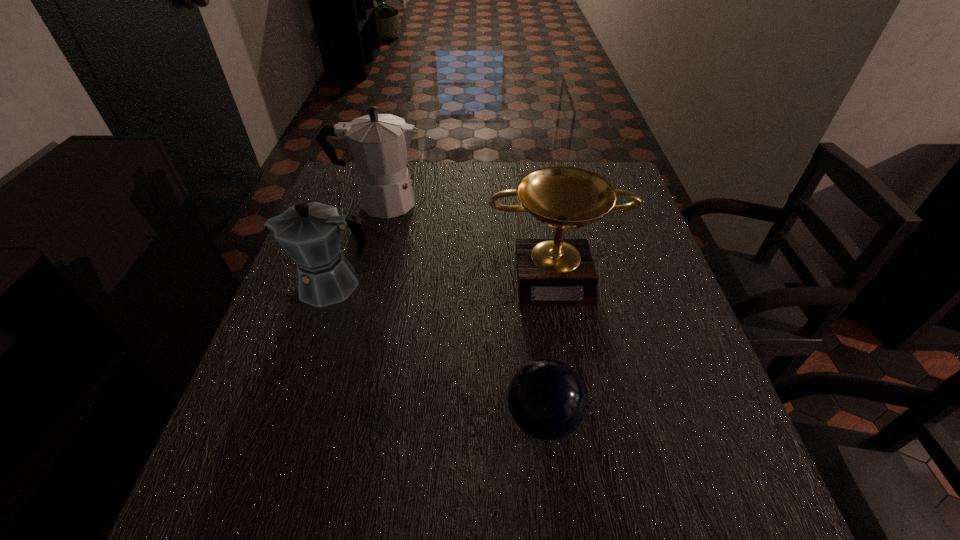
Image resolution: width=960 pixels, height=540 pixels. I want to click on empty location between the nearer coffeepot and the award, so click(444, 279).

Where is `free space that is in between the shorter coffeepot and the award`? This screenshot has height=540, width=960. free space that is in between the shorter coffeepot and the award is located at coordinates (444, 279).

Find the location of a particular element. free spot between the bowling ball and the award is located at coordinates (548, 346).

Where is `free point between the nearer coffeepot and the nearest object`? free point between the nearer coffeepot and the nearest object is located at coordinates (438, 351).

Image resolution: width=960 pixels, height=540 pixels. Find the location of `vacant region between the shortest object and the taller coffeepot`. vacant region between the shortest object and the taller coffeepot is located at coordinates (462, 310).

The width and height of the screenshot is (960, 540). In order to click on free space that is in between the award and the tallest object in this screenshot , I will do `click(468, 238)`.

At what (x,y) coordinates should I click in order to perform the action: click on unoccupied position between the farthest object and the shortest object. Please return your answer as a coordinate pair (x, y). Image resolution: width=960 pixels, height=540 pixels. Looking at the image, I should click on (462, 310).

Locate an element on the screen. Image resolution: width=960 pixels, height=540 pixels. unoccupied position between the shorter coffeepot and the farthest object is located at coordinates (356, 244).

The width and height of the screenshot is (960, 540). Find the location of `blank region between the award and the shorter coffeepot`. blank region between the award and the shorter coffeepot is located at coordinates (444, 279).

I want to click on free space between the taller coffeepot and the bowling ball, so click(x=462, y=310).